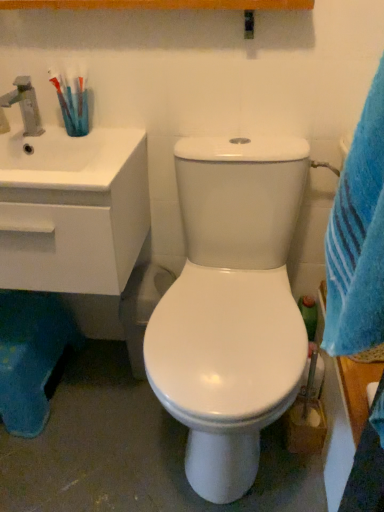
Locate an element on the screen. The image size is (384, 512). vacant space underneath white glossy sink at left (from a real-world perspective) is located at coordinates (99, 380).